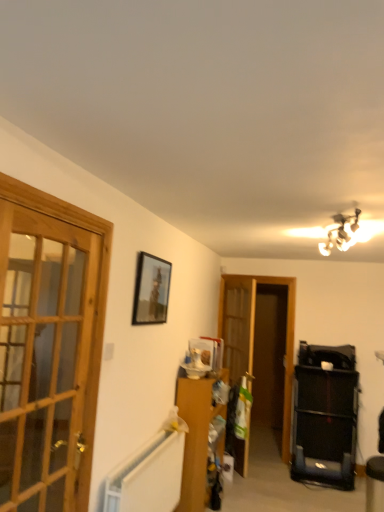
This screenshot has height=512, width=384. In order to click on free space above wooden glass door at left (from a real-world perspective) in this screenshot , I will do `click(57, 219)`.